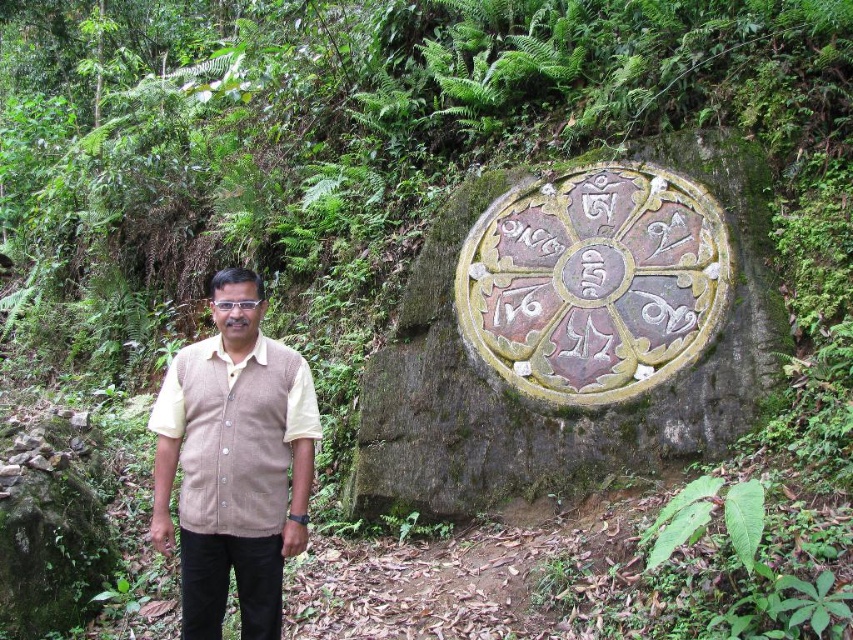
You are an archaeologist examining the carved stone wheel at center and the beige knitted vest at center in the forest scene. Which object appears narrower in the image?

The carved stone wheel at center has a lesser width compared to the beige knitted vest at center, so the carved stone wheel at center appears narrower.

You are a photographer trying to capture a clear shot of both the carved stone wheel at center and the beige knitted vest at center. Based on their positions, which object should you focus on first to ensure both are in frame?

The carved stone wheel at center is positioned on the right side of beige knitted vest at center, so you should focus on the beige knitted vest at center first to ensure both are in frame.